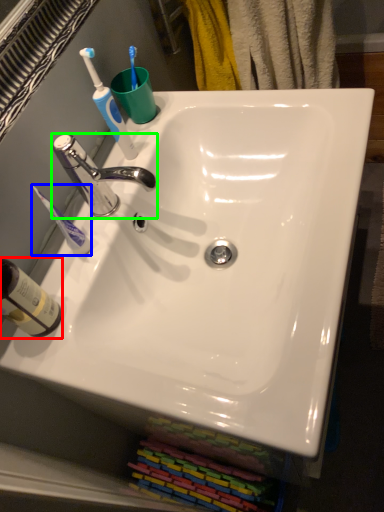
Question: Based on their relative distances, which object is nearer to bottle (highlighted by a red box)? Choose from toothbrush (highlighted by a blue box) and tap (highlighted by a green box).

Choices:
 (A) toothbrush
 (B) tap

Answer: (A)